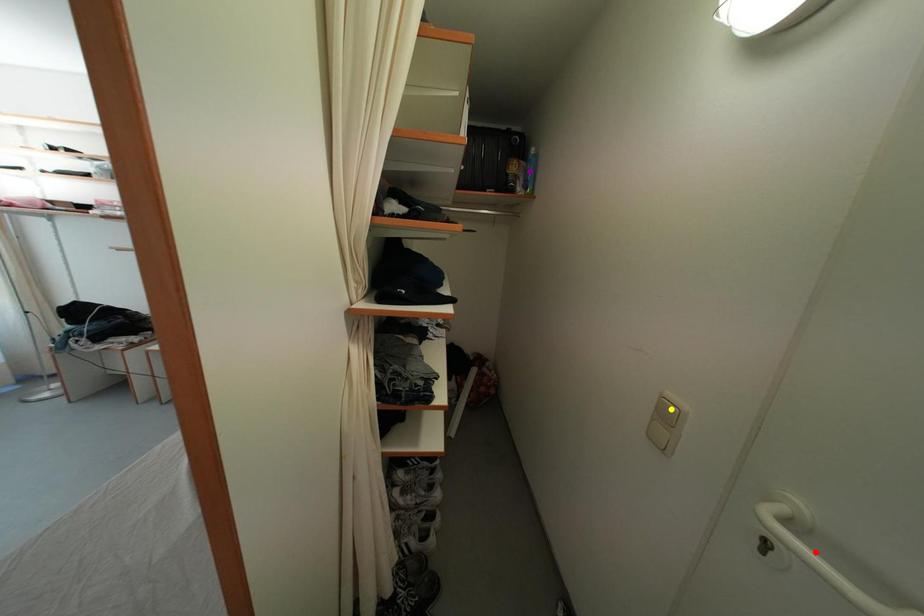
Order these from nearest to farthest:
1. red point
2. yellow point
3. purple point

red point
yellow point
purple point